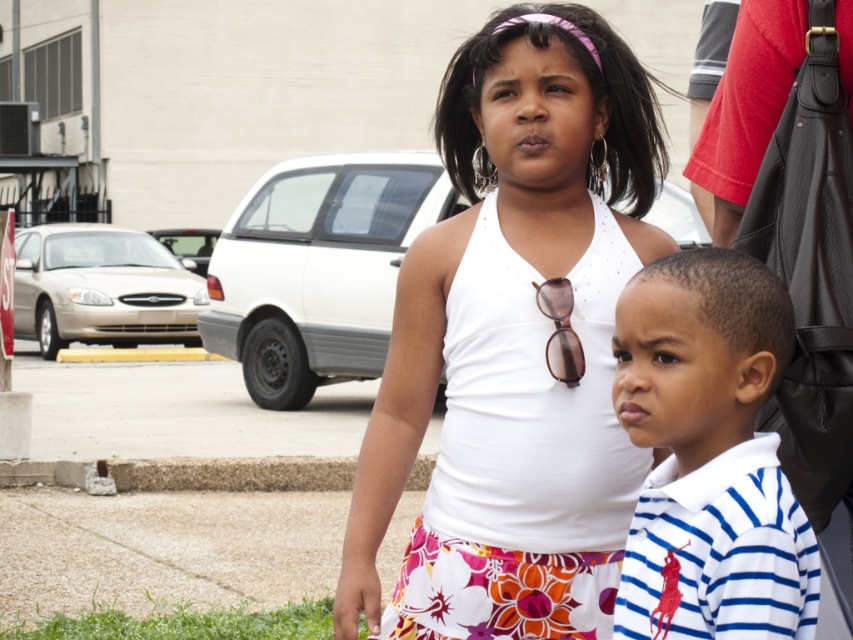
Question: Is white fabric dress at center positioned at the back of white striped polo shirt at lower right?

Choices:
 (A) no
 (B) yes

Answer: (B)

Question: Among these points, which one is farthest from the camera?

Choices:
 (A) (387, 364)
 (B) (628, 368)
 (C) (569, 346)
 (D) (328, 458)

Answer: (D)

Question: Does white fabric dress at center have a lesser width compared to gray concrete curb at lower center?

Choices:
 (A) yes
 (B) no

Answer: (A)

Question: Which of the following is the farthest from the observer?

Choices:
 (A) (13, 461)
 (B) (567, 280)
 (C) (695, 566)
 (D) (437, 268)

Answer: (A)

Question: Is white fabric dress at center to the left of gray concrete curb at lower center from the viewer's perspective?

Choices:
 (A) no
 (B) yes

Answer: (A)

Question: Which of the following is the closest to the observer?

Choices:
 (A) (688, 307)
 (B) (341, 460)
 (C) (581, 356)

Answer: (A)